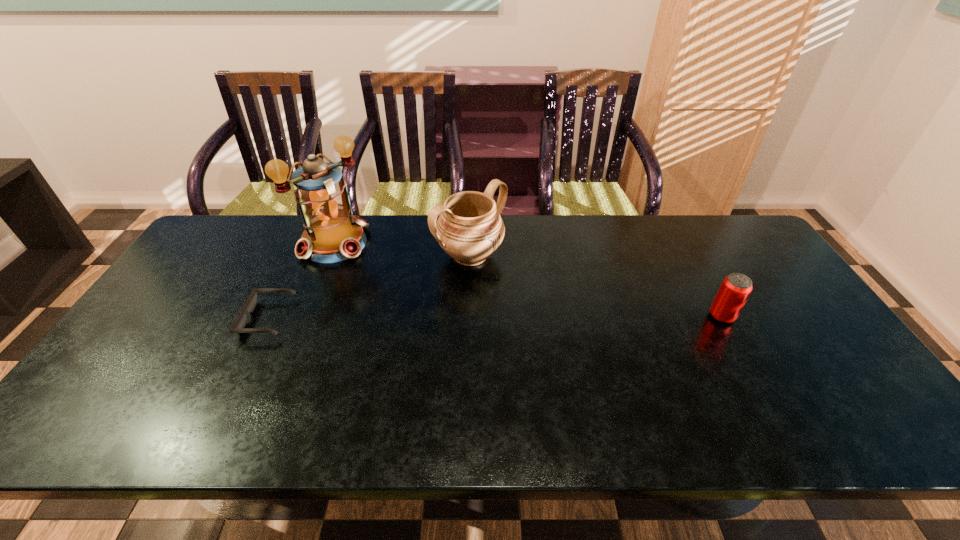
Find the location of `free region located 0.370m on the front-facing side of the tallest object`. free region located 0.370m on the front-facing side of the tallest object is located at coordinates (428, 318).

Where is `vacant space located on the front-facing side of the tallest object`? This screenshot has height=540, width=960. vacant space located on the front-facing side of the tallest object is located at coordinates (396, 291).

This screenshot has height=540, width=960. Find the location of `vacant position located 0.070m on the front-facing side of the tallest object`. vacant position located 0.070m on the front-facing side of the tallest object is located at coordinates [x=366, y=267].

What are the coordinates of `free space located 0.130m on the front-facing side of the urn` in the screenshot? It's located at (525, 294).

This screenshot has width=960, height=540. In order to click on vacant space located on the front-facing side of the urn in this screenshot , I will do `click(567, 326)`.

Identify the location of free space located on the front-facing side of the urn. (525, 294).

The image size is (960, 540). What are the coordinates of `lantern that is positioned at the far edge` in the screenshot? It's located at (332, 233).

Find the location of a particular element. urn positioned at the far edge is located at coordinates (469, 229).

The height and width of the screenshot is (540, 960). Identify the location of vacant area at the far edge. tap(380, 253).

In the image, there is a desktop. At what (x,y) coordinates should I click in order to perform the action: click on blank space at the near edge. Please return your answer as a coordinate pair (x, y). Image resolution: width=960 pixels, height=540 pixels. Looking at the image, I should click on (382, 403).